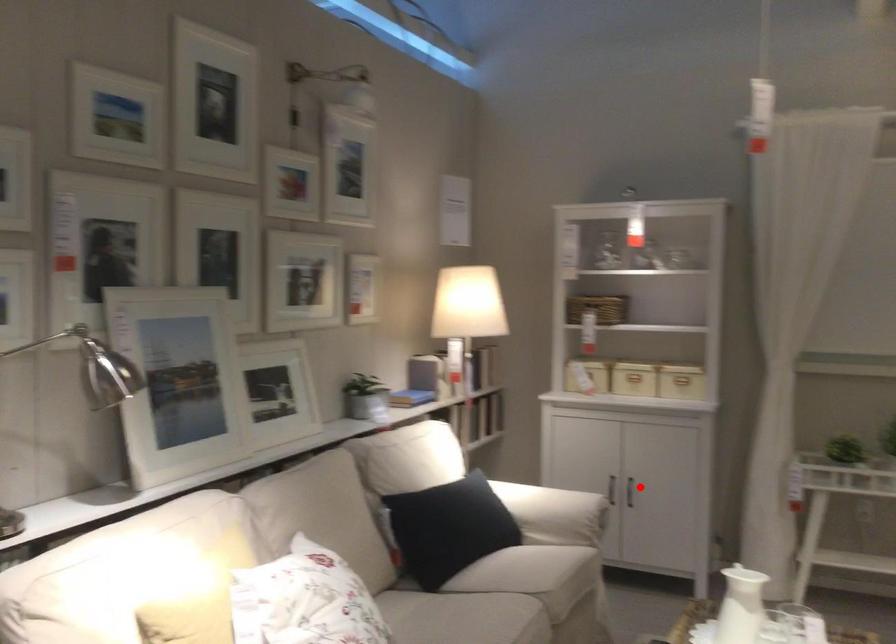
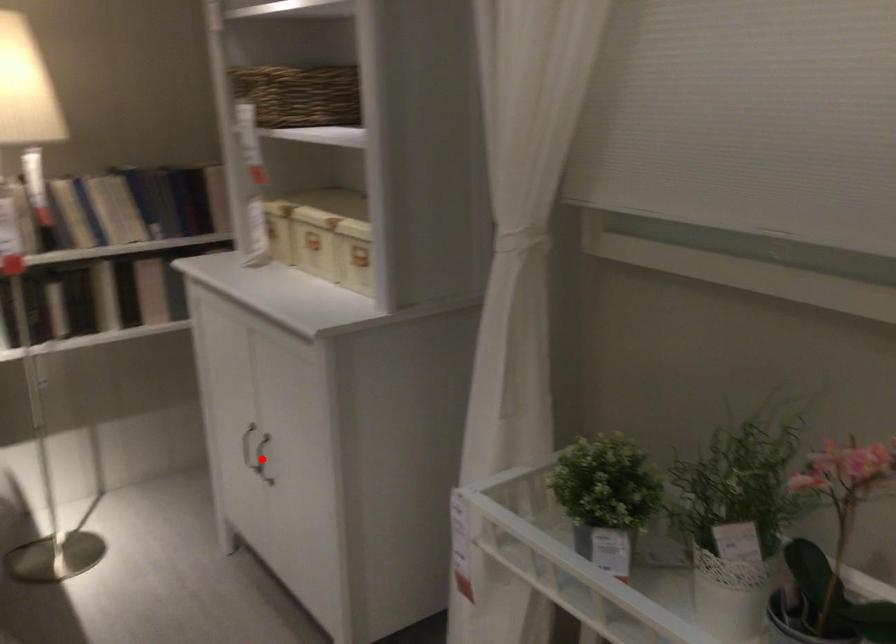
I am providing you with two images of the same scene from different viewpoints. A red point is marked on the first image and another point is marked on the second image. Are the points marked in image1 and image2 representing the same 3D position?

Yes